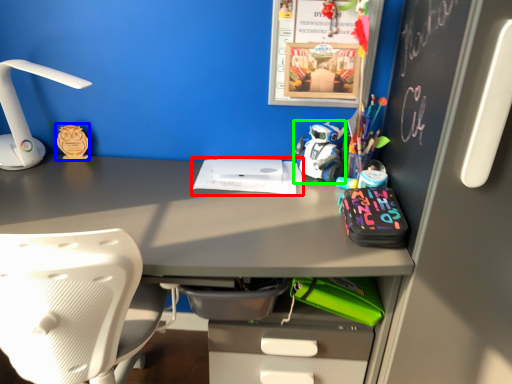
Question: Which is farther away from office supplies (highlighted by a red box)? stationery (highlighted by a blue box) or toy (highlighted by a green box)?

Choices:
 (A) stationery
 (B) toy

Answer: (A)